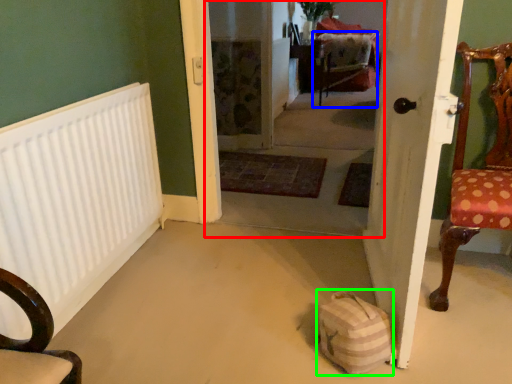
Question: Based on their relative distances, which object is farther from corridor (highlighted by a red box)? Choose from armchair (highlighted by a blue box) and bag (highlighted by a green box).

Choices:
 (A) armchair
 (B) bag

Answer: (B)